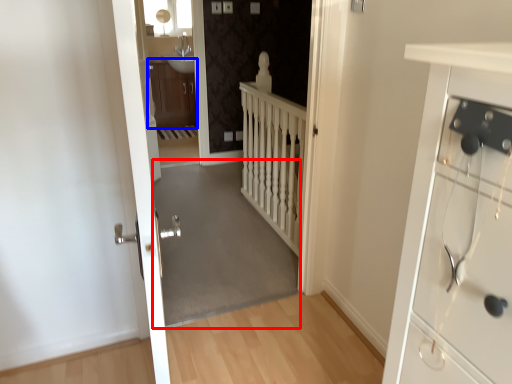
Question: Among these objects, which one is farthest to the camera, corridor (highlighted by a red box) or cabinetry (highlighted by a blue box)?

Choices:
 (A) corridor
 (B) cabinetry

Answer: (B)